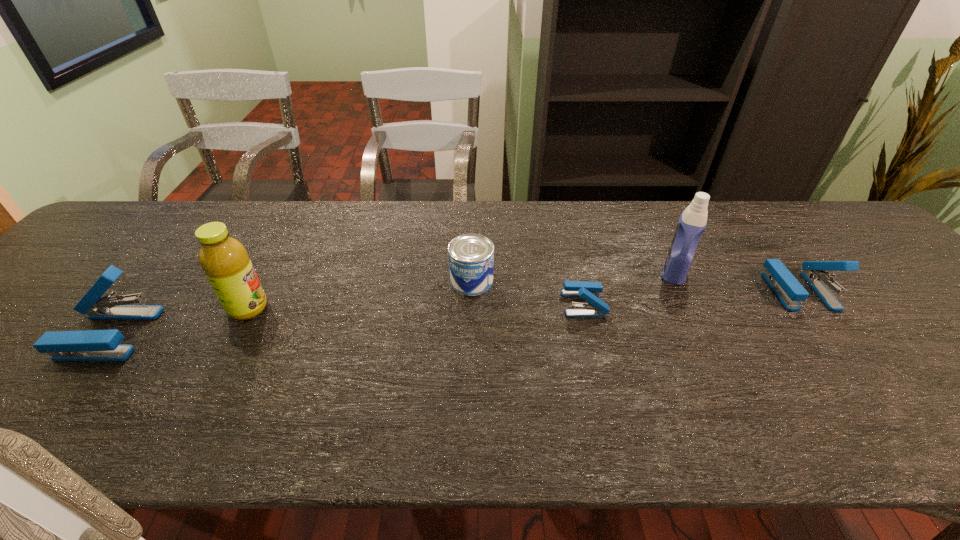
Identify the location of the leftmost object. (89, 345).

Locate an element on the screen. The height and width of the screenshot is (540, 960). the shortest object is located at coordinates (589, 291).

Locate an element on the screen. Image resolution: width=960 pixels, height=540 pixels. the shortest stapler is located at coordinates (589, 291).

Locate an element on the screen. The image size is (960, 540). the second tallest stapler is located at coordinates (787, 288).

You are a GUI agent. You are given a task and a screenshot of the screen. Output one action in this format:
    pyautogui.click(x=<x>, y=<y>)
    Task: Click on the rightmost stapler
    The height and width of the screenshot is (540, 960).
    Given the screenshot: What is the action you would take?
    pyautogui.click(x=787, y=288)

In order to click on can in this screenshot , I will do 471,256.

Identify the location of fruit juice. Image resolution: width=960 pixels, height=540 pixels. (225, 261).

Identify the location of the second object from right to left. The image size is (960, 540). (692, 222).

This screenshot has height=540, width=960. What are the coordinates of `vacant space located on the back of the leftmost object` in the screenshot? It's located at (197, 226).

I want to click on vacant region located on the left of the shortest stapler, so click(510, 303).